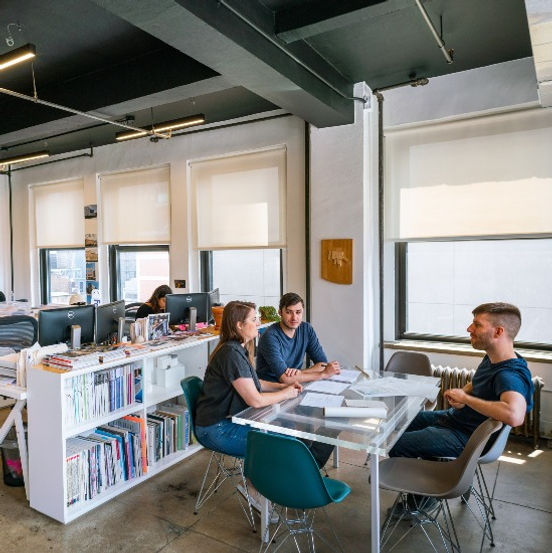
Identify the location of table. 316,425.